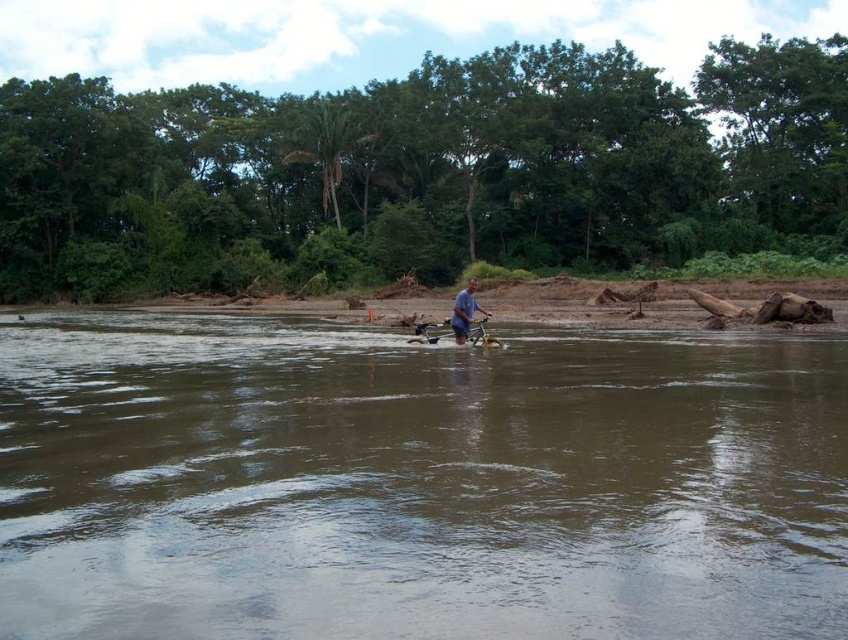
Can you confirm if brown muddy water at center is positioned to the left of blue fabric shirt at center?

Correct, you'll find brown muddy water at center to the left of blue fabric shirt at center.

Between brown muddy water at center and blue fabric shirt at center, which one appears on the right side from the viewer's perspective?

From the viewer's perspective, blue fabric shirt at center appears more on the right side.

Where is `brown muddy water at center`? This screenshot has height=640, width=848. brown muddy water at center is located at coordinates (416, 483).